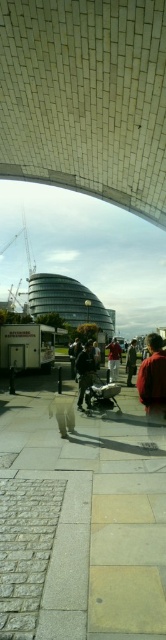
You are standing at the entrance of the arched structure and see two people wearing jackets. One has a dark gray fabric jacket at center and the other has a red fabric jacket at center. Which jacket is positioned more to the left?

The dark gray fabric jacket at center is positioned more to the left than the red fabric jacket at center.

You are standing at the entrance of the arched structure and want to greet both the person wearing the dark gray fabric jacket at center and the person wearing the red fabric jacket at center. Which direction should you walk to reach them first if you want to greet the closest one first?

Both the dark gray fabric jacket at center and the red fabric jacket at center are at the same central position, so you can choose either direction to greet them first as they are equally close.